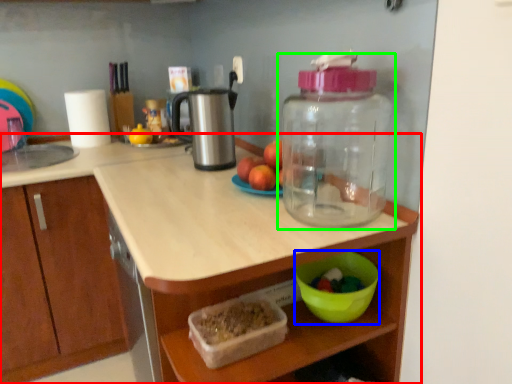
Question: Which object is the closest to the countertop (highlighted by a red box)? Choose among these: bowl (highlighted by a blue box) or bottle (highlighted by a green box).

Choices:
 (A) bowl
 (B) bottle

Answer: (B)